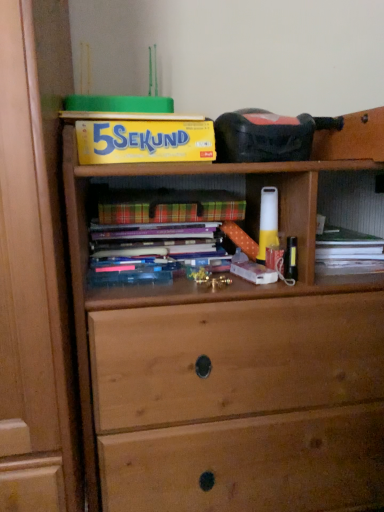
I want to click on free space above plaid paper at center, arranged as the second paperback book when viewed from the top (from a real-world perspective), so click(x=165, y=194).